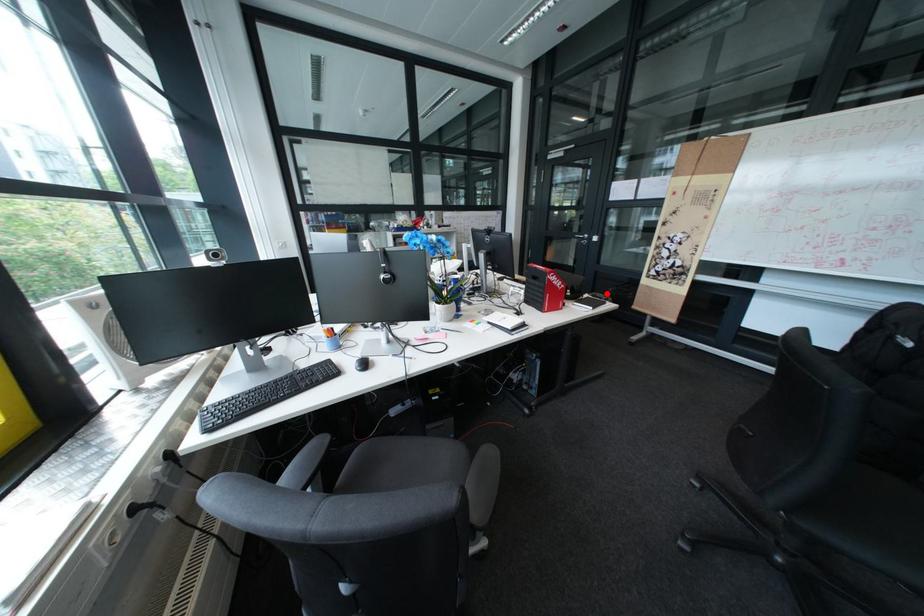
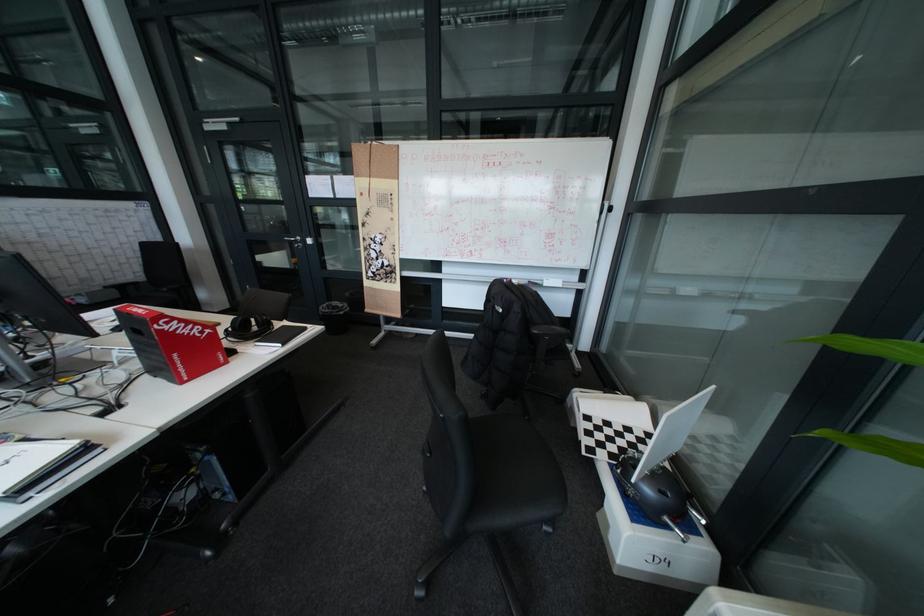
Question: I am providing you with two images of the same scene from different viewpoints. Given a red point in image1, look at the same physical point in image2. Is it:

Choices:
 (A) Closer to the viewpoint
 (B) Farther from the viewpoint

Answer: (A)